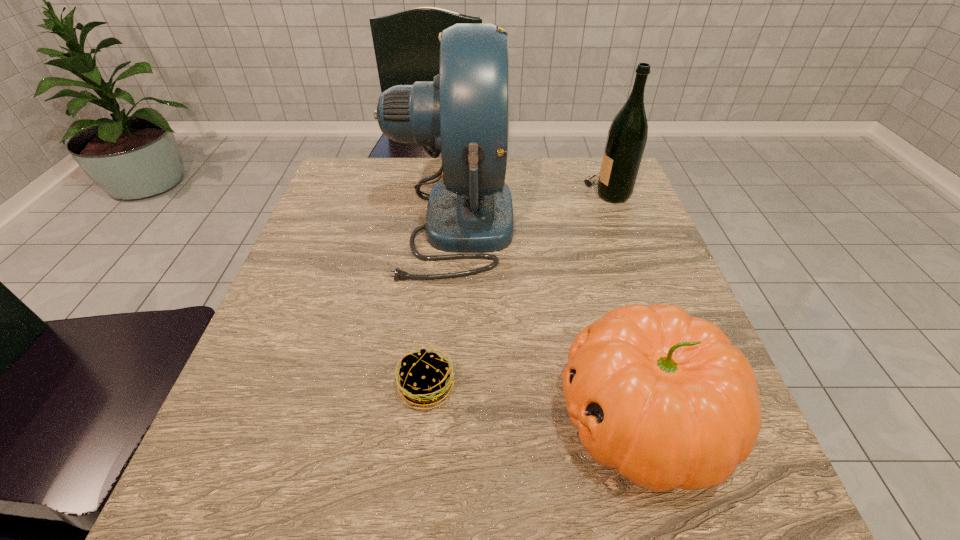
The image size is (960, 540). Find the location of `vacant region that satisfies the following two spatial constraints: 1. on the front side of the third shortest object; 2. on the carved face of the pumpkin`. vacant region that satisfies the following two spatial constraints: 1. on the front side of the third shortest object; 2. on the carved face of the pumpkin is located at coordinates (691, 416).